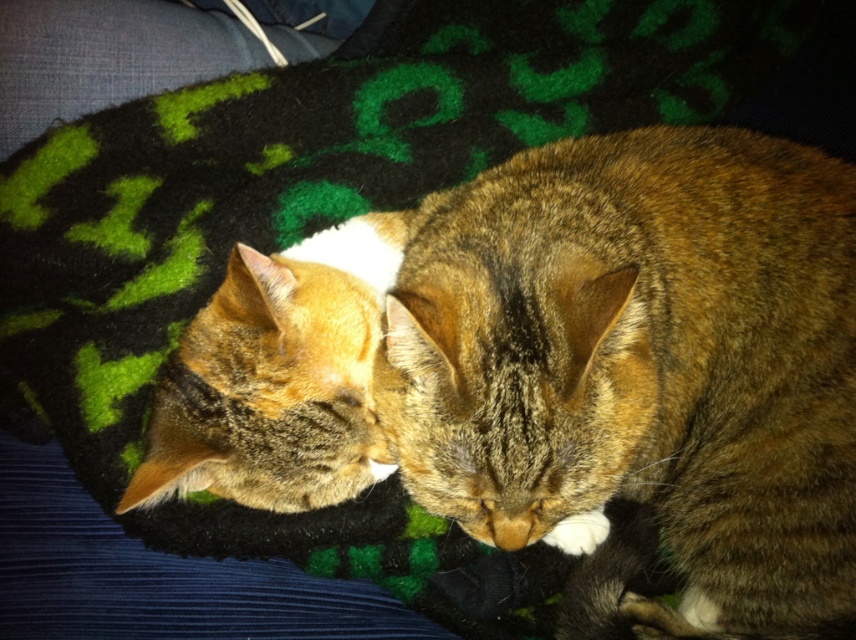
Does tabby fur cat at center have a smaller size compared to tabby fur cat at left?

Incorrect, tabby fur cat at center is not smaller in size than tabby fur cat at left.

Is tabby fur cat at center positioned behind tabby fur cat at left?

No, tabby fur cat at center is closer to the viewer.

Does point (829, 572) come in front of point (270, 400)?

No, it is behind (270, 400).

This screenshot has width=856, height=640. What are the coordinates of `tabby fur cat at center` in the screenshot? It's located at (643, 364).